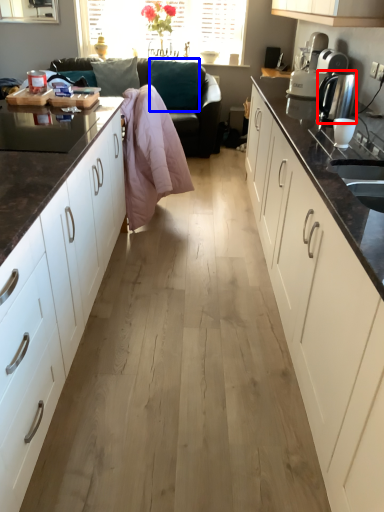
Question: Which point is closer to the camera, kitchen appliance (highlighted by a red box) or pillow (highlighted by a blue box)?

Choices:
 (A) kitchen appliance
 (B) pillow

Answer: (A)